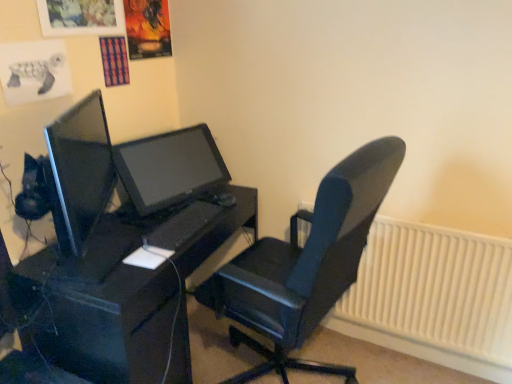
Where is `free point below white plastic radiator at lower right (from a real-world perspective)`? free point below white plastic radiator at lower right (from a real-world perspective) is located at coordinates (397, 351).